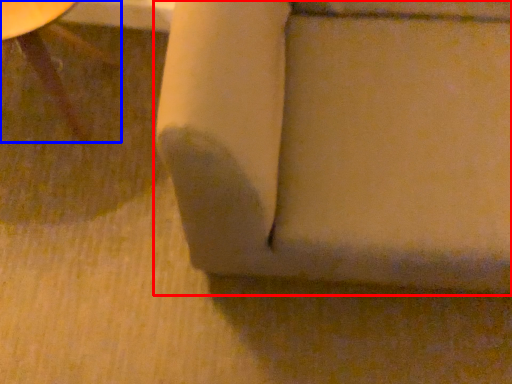
Question: Which of the following is the farthest to the observer, furniture (highlighted by a red box) or furniture (highlighted by a blue box)?

Choices:
 (A) furniture
 (B) furniture

Answer: (B)